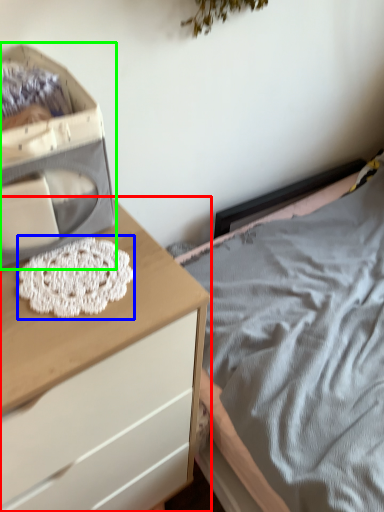
Question: Which is farther away from chest of drawers (highlighted by a red box)? lace (highlighted by a blue box) or storage box (highlighted by a green box)?

Choices:
 (A) lace
 (B) storage box

Answer: (B)